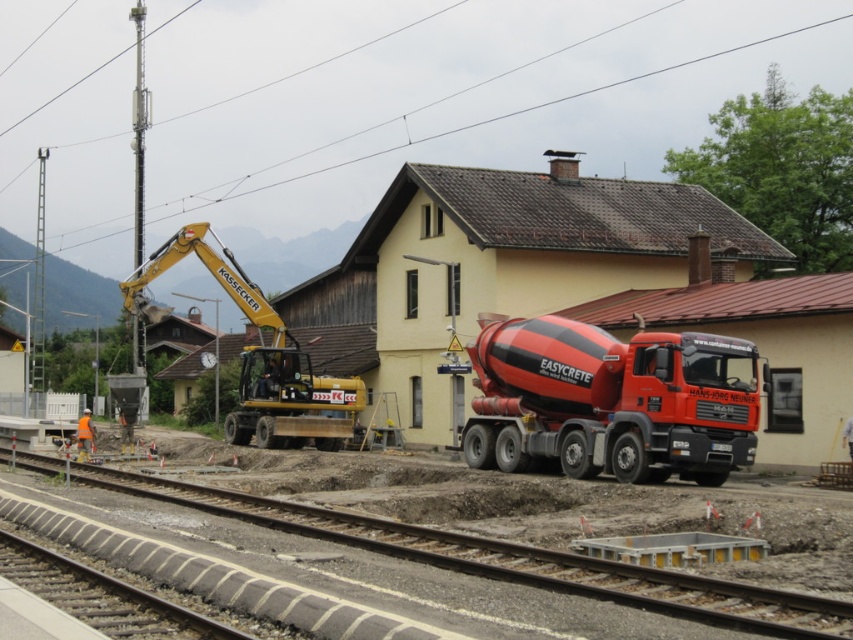
Question: Is red matte concrete mixer at center positioned at the back of yellow metallic excavator at left?

Choices:
 (A) no
 (B) yes

Answer: (A)

Question: Which object is the farthest from the smooth asphalt track at center?

Choices:
 (A) red matte concrete mixer at center
 (B) yellow metallic excavator at left

Answer: (B)

Question: Among these points, which one is nearest to the camera?

Choices:
 (A) (344, 390)
 (B) (840, 632)
 (C) (695, 371)

Answer: (B)

Question: Is red matte concrete mixer at center further to camera compared to yellow metallic excavator at left?

Choices:
 (A) no
 (B) yes

Answer: (A)

Question: Among these objects, which one is farthest from the camera?

Choices:
 (A) yellow metallic excavator at left
 (B) smooth asphalt track at center
 (C) red matte concrete mixer at center

Answer: (A)

Question: Does smooth asphalt track at center have a smaller size compared to yellow metallic excavator at left?

Choices:
 (A) no
 (B) yes

Answer: (B)